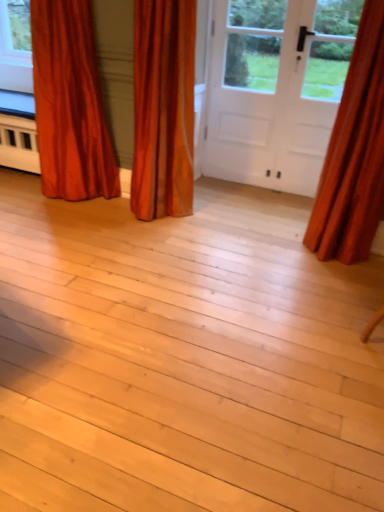
Locate an element on the screen. white matte door at center is located at coordinates (277, 89).

This screenshot has width=384, height=512. What do you see at coordinates (277, 89) in the screenshot? I see `white matte door at center` at bounding box center [277, 89].

What do you see at coordinates (70, 103) in the screenshot? This screenshot has width=384, height=512. I see `velvet orange curtain at left, marked as the first curtain in a left-to-right arrangement` at bounding box center [70, 103].

The height and width of the screenshot is (512, 384). I want to click on satin orange curtain at right, arranged as the 1th curtain when viewed from the right, so click(x=354, y=154).

Can you confirm if satin orange curtain at center, the 2th curtain viewed from the right, is taller than velvet orange curtain at left, which appears as the third curtain when viewed from the right?

Correct, satin orange curtain at center, the 2th curtain viewed from the right, is much taller as velvet orange curtain at left, which appears as the third curtain when viewed from the right.

Which of these two, satin orange curtain at center, acting as the 2th curtain starting from the left, or velvet orange curtain at left, marked as the first curtain in a left-to-right arrangement, is bigger?

velvet orange curtain at left, marked as the first curtain in a left-to-right arrangement.

Do you think satin orange curtain at center, acting as the 2th curtain starting from the left, is within velvet orange curtain at left, marked as the first curtain in a left-to-right arrangement, or outside of it?

satin orange curtain at center, acting as the 2th curtain starting from the left, cannot be found inside velvet orange curtain at left, marked as the first curtain in a left-to-right arrangement.

Which object is positioned more to the left, satin orange curtain at center, the 2th curtain viewed from the right, or velvet orange curtain at left, marked as the first curtain in a left-to-right arrangement?

velvet orange curtain at left, marked as the first curtain in a left-to-right arrangement, is more to the left.

Is white matte door at center oriented away from satin orange curtain at right, arranged as the 1th curtain when viewed from the right?

That's not correct — white matte door at center is not looking away from satin orange curtain at right, arranged as the 1th curtain when viewed from the right.

Is white matte door at center located outside satin orange curtain at right, arranged as the 1th curtain when viewed from the right?

white matte door at center is positioned outside satin orange curtain at right, arranged as the 1th curtain when viewed from the right.

From a real-world perspective, who is located lower, white matte door at center or satin orange curtain at right, which is the third curtain from left to right?

white matte door at center.

Consider the image. From a real-world perspective, between satin orange curtain at right, arranged as the 1th curtain when viewed from the right, and satin orange curtain at center, the 2th curtain viewed from the right, who is vertically higher?

In real-world perspective, satin orange curtain at right, arranged as the 1th curtain when viewed from the right, is above.

How many degrees apart are the facing directions of satin orange curtain at right, which is the third curtain from left to right, and satin orange curtain at center, the 2th curtain viewed from the right?

The angular difference between satin orange curtain at right, which is the third curtain from left to right, and satin orange curtain at center, the 2th curtain viewed from the right, is 1.62 degrees.

This screenshot has width=384, height=512. Find the location of `curtain below the satin orange curtain at center, the 2th curtain viewed from the right (from the image's perspective)`. curtain below the satin orange curtain at center, the 2th curtain viewed from the right (from the image's perspective) is located at coordinates (354, 154).

From a real-world perspective, is satin orange curtain at right, which is the third curtain from left to right, above or below velvet orange curtain at left, which appears as the third curtain when viewed from the right?

In terms of real-world spatial position, satin orange curtain at right, which is the third curtain from left to right, is above velvet orange curtain at left, which appears as the third curtain when viewed from the right.

From the image's perspective, is satin orange curtain at right, arranged as the 1th curtain when viewed from the right, above velvet orange curtain at left, marked as the first curtain in a left-to-right arrangement?

Incorrect, from the image's perspective, satin orange curtain at right, arranged as the 1th curtain when viewed from the right, is lower than velvet orange curtain at left, marked as the first curtain in a left-to-right arrangement.

Is satin orange curtain at right, which is the third curtain from left to right, touching velvet orange curtain at left, marked as the first curtain in a left-to-right arrangement?

satin orange curtain at right, which is the third curtain from left to right, and velvet orange curtain at left, marked as the first curtain in a left-to-right arrangement, are clearly separated.

Identify the location of curtain on the right of satin orange curtain at center, acting as the 2th curtain starting from the left. (354, 154).

Does point (169, 30) come behind point (377, 21)?

Yes, it is.

How many degrees apart are the facing directions of satin orange curtain at center, acting as the 2th curtain starting from the left, and satin orange curtain at right, arranged as the 1th curtain when viewed from the right?

The angle between the facing direction of satin orange curtain at center, acting as the 2th curtain starting from the left, and the facing direction of satin orange curtain at right, arranged as the 1th curtain when viewed from the right, is 1.62 degrees.

Is satin orange curtain at right, arranged as the 1th curtain when viewed from the right, located within satin orange curtain at center, the 2th curtain viewed from the right?

No, satin orange curtain at right, arranged as the 1th curtain when viewed from the right, is not surrounded by satin orange curtain at center, the 2th curtain viewed from the right.

Is white matte door at center located within satin orange curtain at right, which is the third curtain from left to right?

No, white matte door at center is located outside of satin orange curtain at right, which is the third curtain from left to right.

From a real-world perspective, is satin orange curtain at right, which is the third curtain from left to right, positioned above or below white matte door at center?

In terms of real-world spatial position, satin orange curtain at right, which is the third curtain from left to right, is above white matte door at center.

How different are the orientations of satin orange curtain at right, which is the third curtain from left to right, and white matte door at center in degrees?

They differ by 2.42 degrees in their facing directions.

Considering the relative sizes of satin orange curtain at right, arranged as the 1th curtain when viewed from the right, and white matte door at center in the image provided, is satin orange curtain at right, arranged as the 1th curtain when viewed from the right, taller than white matte door at center?

Correct, satin orange curtain at right, arranged as the 1th curtain when viewed from the right, is much taller as white matte door at center.

Can you confirm if velvet orange curtain at left, which appears as the third curtain when viewed from the right, is bigger than white matte door at center?

Yes, velvet orange curtain at left, which appears as the third curtain when viewed from the right, is bigger than white matte door at center.

From a real-world perspective, who is located higher, velvet orange curtain at left, which appears as the third curtain when viewed from the right, or white matte door at center?

From a 3D spatial view, white matte door at center is above.

Considering the sizes of objects velvet orange curtain at left, marked as the first curtain in a left-to-right arrangement, and white matte door at center in the image provided, who is thinner, velvet orange curtain at left, marked as the first curtain in a left-to-right arrangement, or white matte door at center?

white matte door at center is thinner.

The image size is (384, 512). Identify the location of the 1st curtain positioned below the white matte door at center (from the image's perspective). (70, 103).

Where is `curtain that appears above the satin orange curtain at center, acting as the 2th curtain starting from the left (from the image's perspective)`? The width and height of the screenshot is (384, 512). curtain that appears above the satin orange curtain at center, acting as the 2th curtain starting from the left (from the image's perspective) is located at coordinates (70, 103).

Where is `curtain above the white matte door at center (from a real-world perspective)`? This screenshot has width=384, height=512. curtain above the white matte door at center (from a real-world perspective) is located at coordinates (354, 154).

Which object lies nearer to the anchor point white matte door at center, velvet orange curtain at left, marked as the first curtain in a left-to-right arrangement, or satin orange curtain at right, which is the third curtain from left to right?

Among the two, satin orange curtain at right, which is the third curtain from left to right, is located nearer to white matte door at center.

Estimate the real-world distances between objects in this image. Which object is closer to white matte door at center, velvet orange curtain at left, marked as the first curtain in a left-to-right arrangement, or satin orange curtain at center, the 2th curtain viewed from the right?

satin orange curtain at center, the 2th curtain viewed from the right, is positioned closer to the anchor white matte door at center.

Based on their spatial positions, is velvet orange curtain at left, which appears as the third curtain when viewed from the right, or satin orange curtain at center, the 2th curtain viewed from the right, further from satin orange curtain at right, which is the third curtain from left to right?

The object further to satin orange curtain at right, which is the third curtain from left to right, is velvet orange curtain at left, which appears as the third curtain when viewed from the right.

Looking at the image, which one is located further to white matte door at center, satin orange curtain at right, which is the third curtain from left to right, or satin orange curtain at center, the 2th curtain viewed from the right?

Based on the image, satin orange curtain at right, which is the third curtain from left to right, appears to be further to white matte door at center.

Considering their positions, is white matte door at center positioned further to velvet orange curtain at left, which appears as the third curtain when viewed from the right, than satin orange curtain at right, arranged as the 1th curtain when viewed from the right?

satin orange curtain at right, arranged as the 1th curtain when viewed from the right, lies further to velvet orange curtain at left, which appears as the third curtain when viewed from the right, than the other object.

Based on their spatial positions, is satin orange curtain at center, the 2th curtain viewed from the right, or white matte door at center further from velvet orange curtain at left, marked as the first curtain in a left-to-right arrangement?

white matte door at center is further to velvet orange curtain at left, marked as the first curtain in a left-to-right arrangement.

Based on their spatial positions, is velvet orange curtain at left, which appears as the third curtain when viewed from the right, or white matte door at center closer to satin orange curtain at right, arranged as the 1th curtain when viewed from the right?

white matte door at center is positioned closer to the anchor satin orange curtain at right, arranged as the 1th curtain when viewed from the right.

Estimate the real-world distances between objects in this image. Which object is further from white matte door at center, satin orange curtain at center, acting as the 2th curtain starting from the left, or velvet orange curtain at left, which appears as the third curtain when viewed from the right?

velvet orange curtain at left, which appears as the third curtain when viewed from the right.

Identify the location of curtain located between velvet orange curtain at left, marked as the first curtain in a left-to-right arrangement, and white matte door at center in the left-right direction. This screenshot has height=512, width=384. (163, 108).

The width and height of the screenshot is (384, 512). What are the coordinates of `door situated between satin orange curtain at center, the 2th curtain viewed from the right, and satin orange curtain at right, which is the third curtain from left to right, from left to right` in the screenshot? It's located at (277, 89).

Locate an element on the screen. The image size is (384, 512). door located between velvet orange curtain at left, which appears as the third curtain when viewed from the right, and satin orange curtain at right, arranged as the 1th curtain when viewed from the right, in the left-right direction is located at coordinates point(277,89).

You are a GUI agent. You are given a task and a screenshot of the screen. Output one action in this format:
    pyautogui.click(x=<x>, y=<y>)
    Task: Click on the curtain between velvet orange curtain at left, marked as the first curtain in a left-to-right arrangement, and satin orange curtain at right, arranged as the 1th curtain when viewed from the right, from left to right
    The image size is (384, 512).
    Given the screenshot: What is the action you would take?
    pyautogui.click(x=163, y=108)